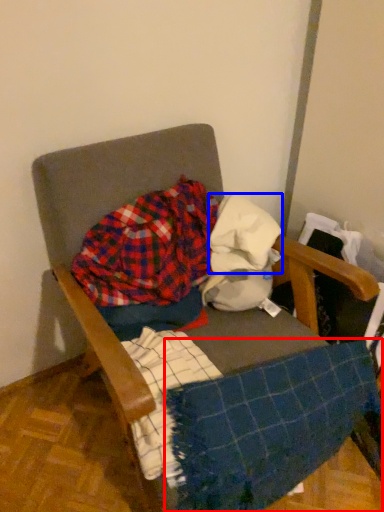
Question: Which point is closer to the camera, blanket (highlighted by a red box) or fabric (highlighted by a blue box)?

Choices:
 (A) blanket
 (B) fabric

Answer: (A)